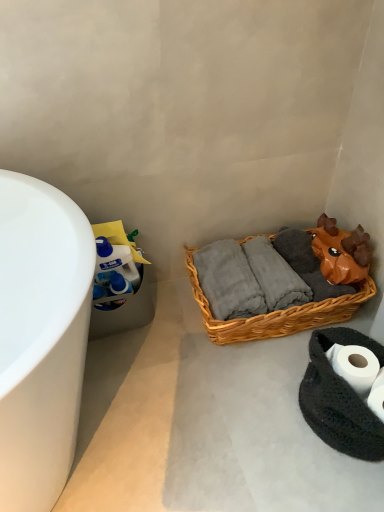
Find the location of `free spot in front of woven brown basket at center`. free spot in front of woven brown basket at center is located at coordinates (250, 415).